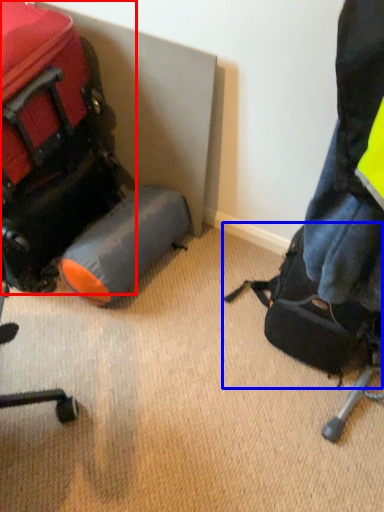
Question: Which object appears farthest to the camera in this image, luggage and bags (highlighted by a red box) or luggage and bags (highlighted by a blue box)?

Choices:
 (A) luggage and bags
 (B) luggage and bags

Answer: (B)